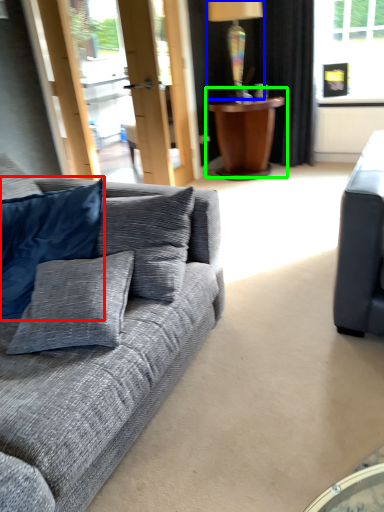
Question: Based on their relative distances, which object is nearer to pillow (highlighted by a red box)? Choose from lamp (highlighted by a blue box) and table (highlighted by a green box).

Choices:
 (A) lamp
 (B) table

Answer: (B)